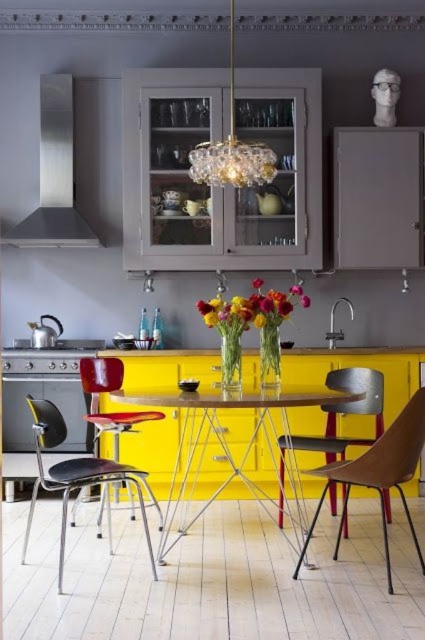
Question: Which object is positioned closest to the yellow glossy table at center?

Choices:
 (A) wooden chair at center
 (B) metallic red chair at left
 (C) glossy floral bouquet at center

Answer: (B)

Question: Where is metallic silver chair at center located in relation to matte plastic glasses at upper right in the image?

Choices:
 (A) left
 (B) right

Answer: (A)

Question: Among these points, which one is nearest to the camera?

Choices:
 (A) (244, 154)
 (B) (19, 428)
 (C) (300, 298)
 (D) (156, 417)

Answer: (A)

Question: Which object is the closest to the black plastic chair at left?

Choices:
 (A) stainless steel oven at left
 (B) glossy glass vase at center
 (C) stainless steel exhaust hood at upper left

Answer: (A)

Question: From the image, what is the correct spatial relationship of stainless steel oven at left in relation to metallic red chair at left?

Choices:
 (A) above
 (B) below

Answer: (A)

Question: Does wooden chair at center have a larger size compared to matte plastic glasses at upper right?

Choices:
 (A) no
 (B) yes

Answer: (B)